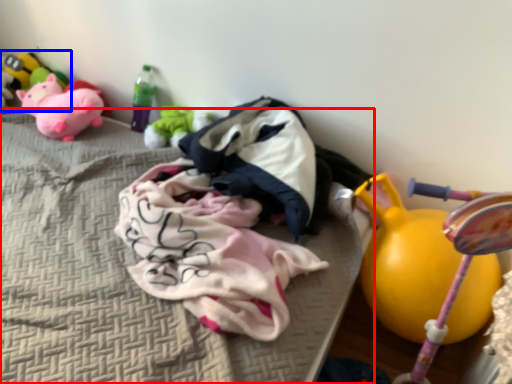
Question: Which object is closer to the camera taking this photo, mattress (highlighted by a red box) or toy (highlighted by a blue box)?

Choices:
 (A) mattress
 (B) toy

Answer: (A)